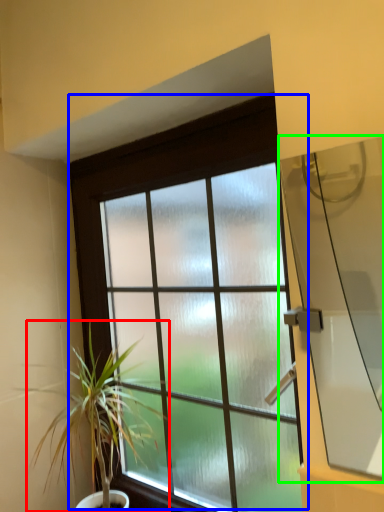
Question: Based on their relative distances, which object is nearer to houseplant (highlighted by a red box)? Choose from window (highlighted by a blue box) and window screen (highlighted by a green box).

Choices:
 (A) window
 (B) window screen

Answer: (A)